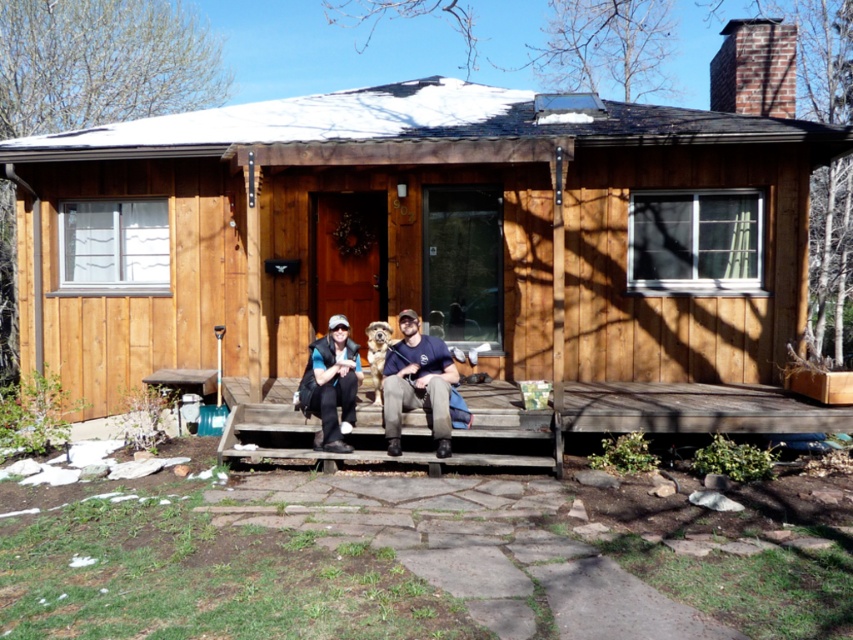
Between point (495, 410) and point (416, 342), which one is positioned behind?

The point (416, 342) is behind.

Who is shorter, wooden bench at center or dark blue t-shirt at center?

wooden bench at center is shorter.

Does point (500, 458) lie behind point (440, 433)?

That is False.

Image resolution: width=853 pixels, height=640 pixels. In order to click on wooden bench at center in this screenshot , I will do 466,433.

Is point (119, 145) positioned after point (322, 435)?

Yes, point (119, 145) is farther from viewer.

Who is more forward, (280,275) or (323,432)?

Positioned in front is point (323,432).

Locate an element on the screen. This screenshot has height=640, width=853. wooden cabin at center is located at coordinates (430, 228).

Where is `wooden cabin at center`? wooden cabin at center is located at coordinates (x=430, y=228).

Which of these two, blue fabric jacket at center or blue denim jacket at center, stands taller?

Standing taller between the two is blue fabric jacket at center.

Does blue fabric jacket at center have a larger size compared to blue denim jacket at center?

Indeed, blue fabric jacket at center has a larger size compared to blue denim jacket at center.

You are a GUI agent. You are given a task and a screenshot of the screen. Output one action in this format:
    pyautogui.click(x=<x>, y=<y>)
    Task: Click on the blue fabric jacket at center
    This screenshot has width=853, height=640.
    Given the screenshot: What is the action you would take?
    pyautogui.click(x=418, y=385)